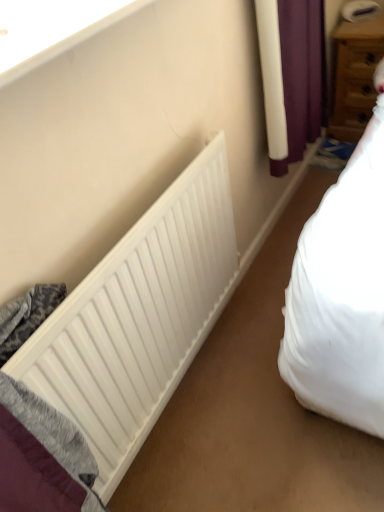
Question: Does white smooth window sill at upper left have a greater width compared to white matte radiator at lower left?

Choices:
 (A) no
 (B) yes

Answer: (B)

Question: Is white smooth window sill at upper left located outside white matte radiator at lower left?

Choices:
 (A) no
 (B) yes

Answer: (B)

Question: Does white smooth window sill at upper left have a smaller size compared to white matte radiator at lower left?

Choices:
 (A) yes
 (B) no

Answer: (A)

Question: Considering the relative sizes of white smooth window sill at upper left and white matte radiator at lower left in the image provided, is white smooth window sill at upper left taller than white matte radiator at lower left?

Choices:
 (A) no
 (B) yes

Answer: (A)

Question: Is white smooth window sill at upper left directly adjacent to white matte radiator at lower left?

Choices:
 (A) yes
 (B) no

Answer: (B)

Question: Is white matte radiator at lower left completely or partially inside white smooth window sill at upper left?

Choices:
 (A) no
 (B) yes

Answer: (A)

Question: Is white smooth window sill at upper left next to wooden drawer at upper right and touching it?

Choices:
 (A) no
 (B) yes

Answer: (A)

Question: Is white smooth window sill at upper left positioned with its back to wooden drawer at upper right?

Choices:
 (A) no
 (B) yes

Answer: (A)

Question: From the image's perspective, would you say white smooth window sill at upper left is positioned over wooden drawer at upper right?

Choices:
 (A) no
 (B) yes

Answer: (A)

Question: Considering the relative sizes of white smooth window sill at upper left and wooden drawer at upper right in the image provided, is white smooth window sill at upper left bigger than wooden drawer at upper right?

Choices:
 (A) no
 (B) yes

Answer: (A)

Question: Does white smooth window sill at upper left turn towards wooden drawer at upper right?

Choices:
 (A) no
 (B) yes

Answer: (A)

Question: Is white smooth window sill at upper left behind wooden drawer at upper right?

Choices:
 (A) yes
 (B) no

Answer: (B)

Question: From a real-world perspective, is white matte radiator at lower left positioned over white smooth window sill at upper left based on gravity?

Choices:
 (A) no
 (B) yes

Answer: (A)